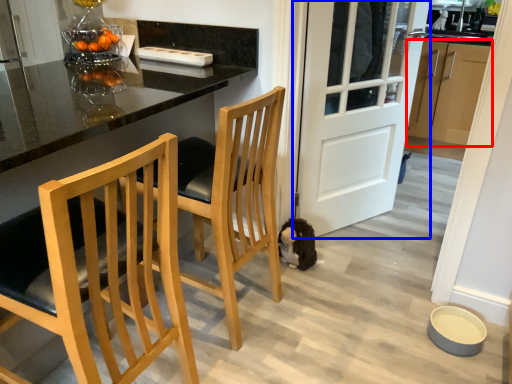
Question: Which of the following is the farthest to the observer, cabinetry (highlighted by a red box) or door (highlighted by a blue box)?

Choices:
 (A) cabinetry
 (B) door

Answer: (A)